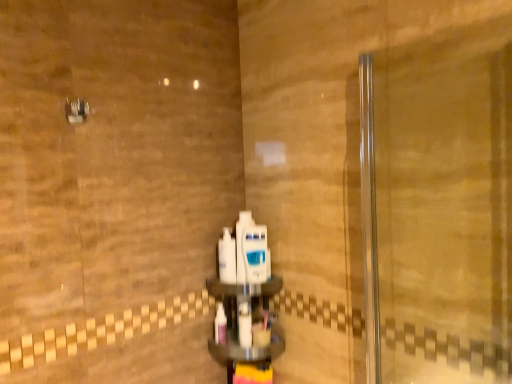
I want to click on vacant space situated above clear glass screen door at right (from a real-world perspective), so click(440, 34).